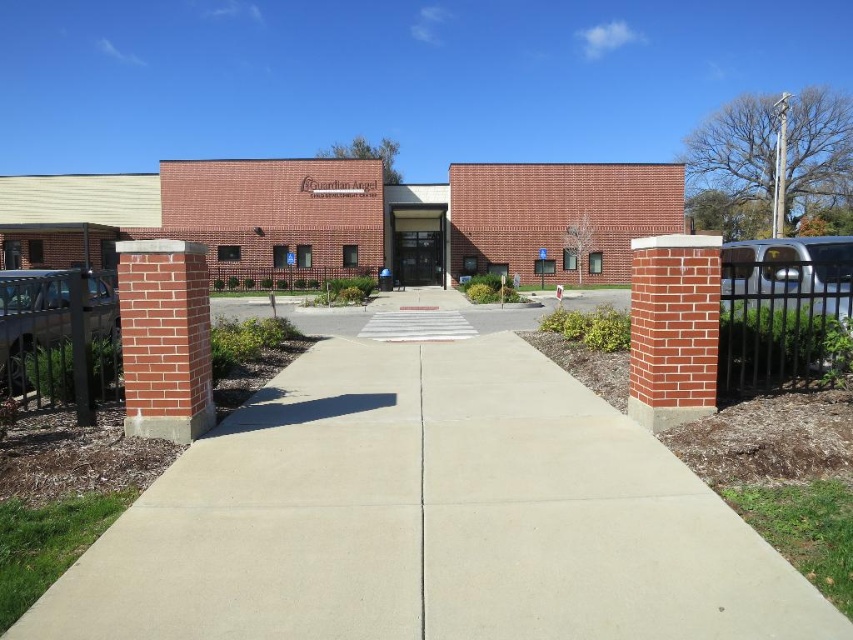
Question: Where is concrete at center located in relation to brick building at center in the image?

Choices:
 (A) above
 (B) below

Answer: (B)

Question: In this image, where is concrete at center located relative to brick building at center?

Choices:
 (A) right
 (B) left

Answer: (A)

Question: Which object is farther from the camera taking this photo?

Choices:
 (A) concrete at center
 (B) brick building at center

Answer: (B)

Question: Observing the image, what is the correct spatial positioning of concrete at center in reference to brick building at center?

Choices:
 (A) below
 (B) above

Answer: (A)

Question: Which object is farther from the camera taking this photo?

Choices:
 (A) concrete at center
 (B) brick building at center

Answer: (B)